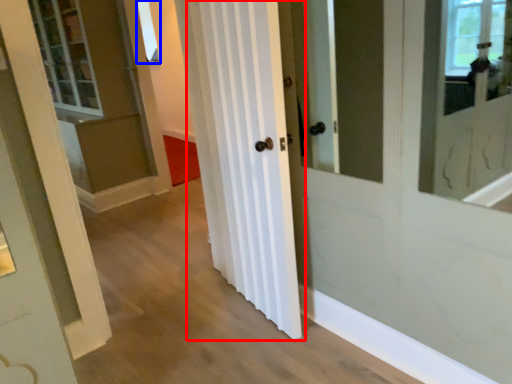
Question: Which of the following is the farthest to the observer, curtain (highlighted by a red box) or window (highlighted by a blue box)?

Choices:
 (A) curtain
 (B) window

Answer: (B)